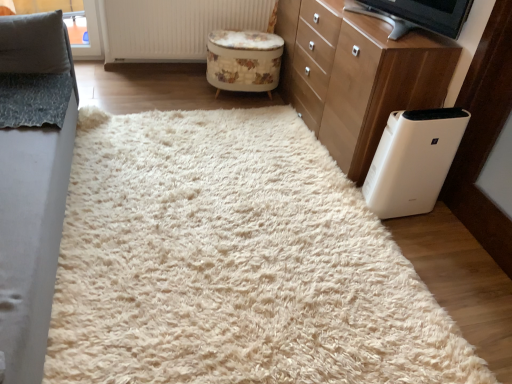
Question: From the image's perspective, is floral-patterned fabric stool at center on top of white textured radiator at upper center?

Choices:
 (A) no
 (B) yes

Answer: (A)

Question: Can you confirm if floral-patterned fabric stool at center is thinner than white textured radiator at upper center?

Choices:
 (A) yes
 (B) no

Answer: (B)

Question: Can you confirm if floral-patterned fabric stool at center is smaller than white textured radiator at upper center?

Choices:
 (A) yes
 (B) no

Answer: (A)

Question: From a real-world perspective, is floral-patterned fabric stool at center positioned over white textured radiator at upper center based on gravity?

Choices:
 (A) yes
 (B) no

Answer: (B)

Question: Is floral-patterned fabric stool at center outside white textured radiator at upper center?

Choices:
 (A) no
 (B) yes

Answer: (B)

Question: Does floral-patterned fabric stool at center contain white textured radiator at upper center?

Choices:
 (A) yes
 (B) no

Answer: (B)

Question: Is floral-patterned fabric stool at center not inside gray fabric couch at left?

Choices:
 (A) no
 (B) yes

Answer: (B)

Question: Considering the relative positions of floral-patterned fabric stool at center and gray fabric couch at left in the image provided, is floral-patterned fabric stool at center behind gray fabric couch at left?

Choices:
 (A) no
 (B) yes

Answer: (B)

Question: Does floral-patterned fabric stool at center have a larger size compared to gray fabric couch at left?

Choices:
 (A) no
 (B) yes

Answer: (A)

Question: Is floral-patterned fabric stool at center looking in the opposite direction of gray fabric couch at left?

Choices:
 (A) no
 (B) yes

Answer: (A)

Question: Considering the relative positions of floral-patterned fabric stool at center and gray fabric couch at left in the image provided, is floral-patterned fabric stool at center to the right of gray fabric couch at left from the viewer's perspective?

Choices:
 (A) no
 (B) yes

Answer: (B)

Question: Does floral-patterned fabric stool at center touch gray fabric couch at left?

Choices:
 (A) no
 (B) yes

Answer: (A)

Question: Is white fluffy rug at center at the left side of floral-patterned fabric stool at center?

Choices:
 (A) yes
 (B) no

Answer: (A)